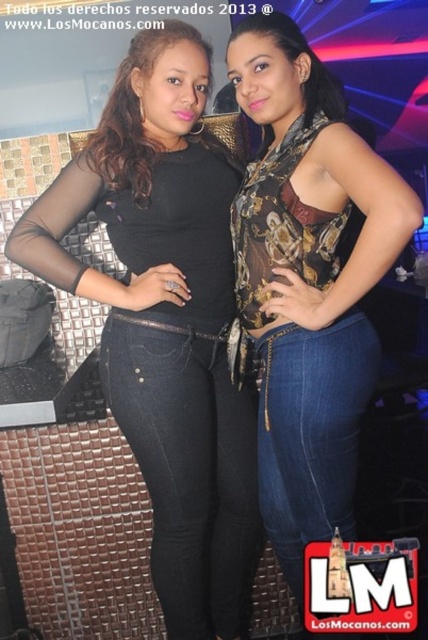
You are at a party and want to take a photo of the matte black top at center and the printed fabric top at center. Which one is positioned lower in the image?

The matte black top at center is located below the printed fabric top at center, so it is positioned lower in the image.